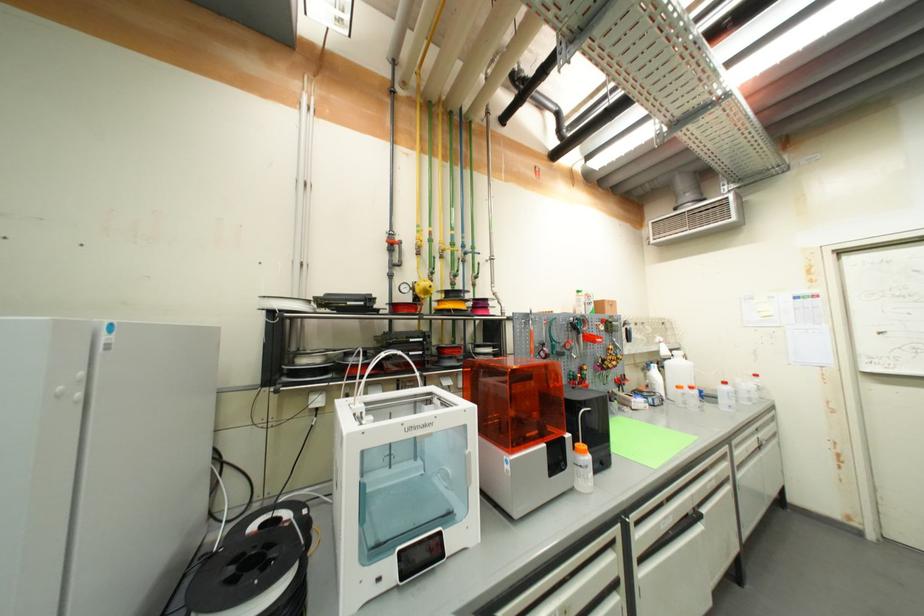
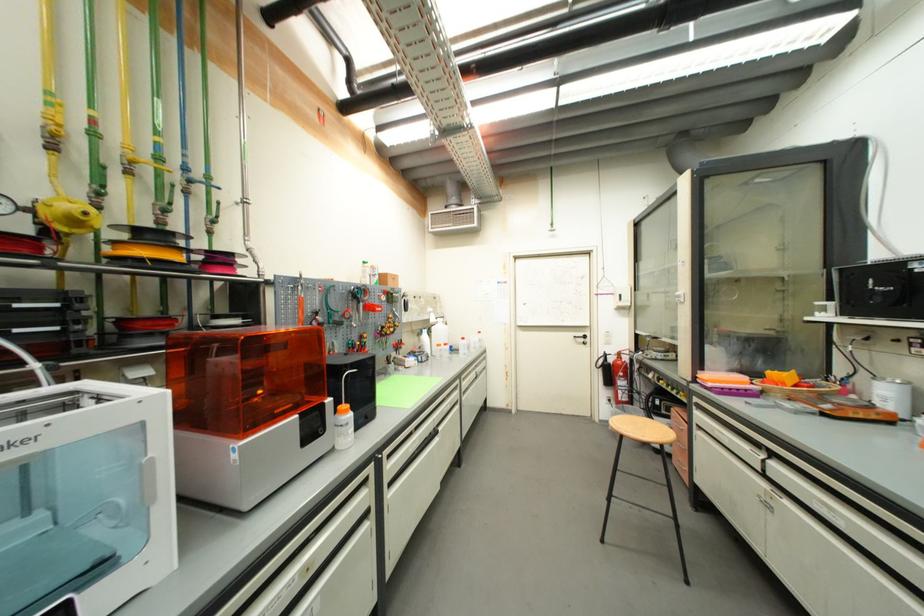
The point at (479, 278) is marked in the first image. Where is the corresponding point in the second image?

(213, 222)